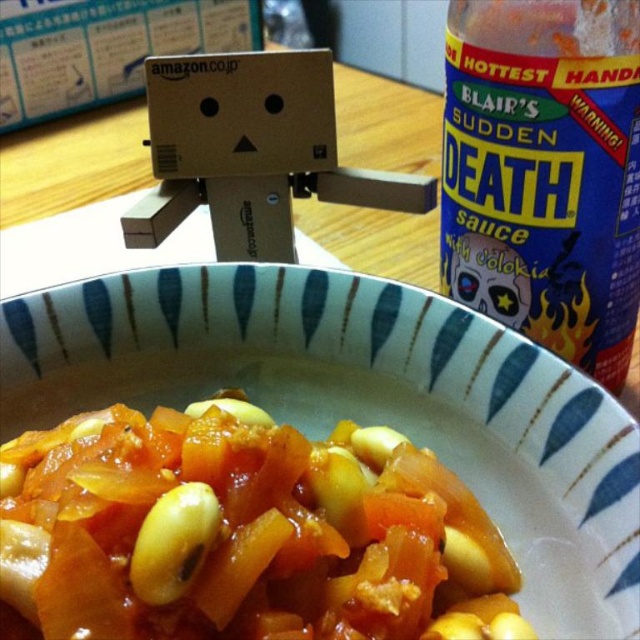
Question: Is yellow matte beans at center to the right of blue plastic bottle at upper right from the viewer's perspective?

Choices:
 (A) no
 (B) yes

Answer: (A)

Question: Estimate the real-world distances between objects in this image. Which object is farther from the blue plastic bottle at upper right?

Choices:
 (A) yellow matte bean at center
 (B) yellow matte beans at center

Answer: (A)

Question: Can you confirm if yellow matte beans at center is thinner than yellow matte bean at center?

Choices:
 (A) yes
 (B) no

Answer: (B)

Question: Which object is closer to the camera taking this photo?

Choices:
 (A) yellow matte beans at center
 (B) blue plastic bottle at upper right

Answer: (A)

Question: Based on their relative distances, which object is nearer to the yellow matte beans at center?

Choices:
 (A) yellow matte bean at center
 (B) blue plastic bottle at upper right

Answer: (A)

Question: Is blue plastic bottle at upper right positioned behind yellow matte bean at center?

Choices:
 (A) yes
 (B) no

Answer: (A)